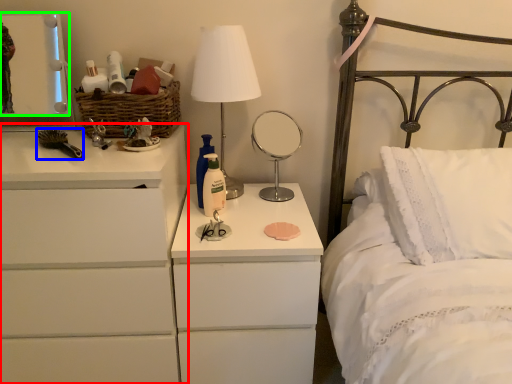
Question: Based on their relative distances, which object is nearer to chest of drawers (highlighted by a red box)? Choose from brush (highlighted by a blue box) and mirror (highlighted by a green box).

Choices:
 (A) brush
 (B) mirror

Answer: (A)